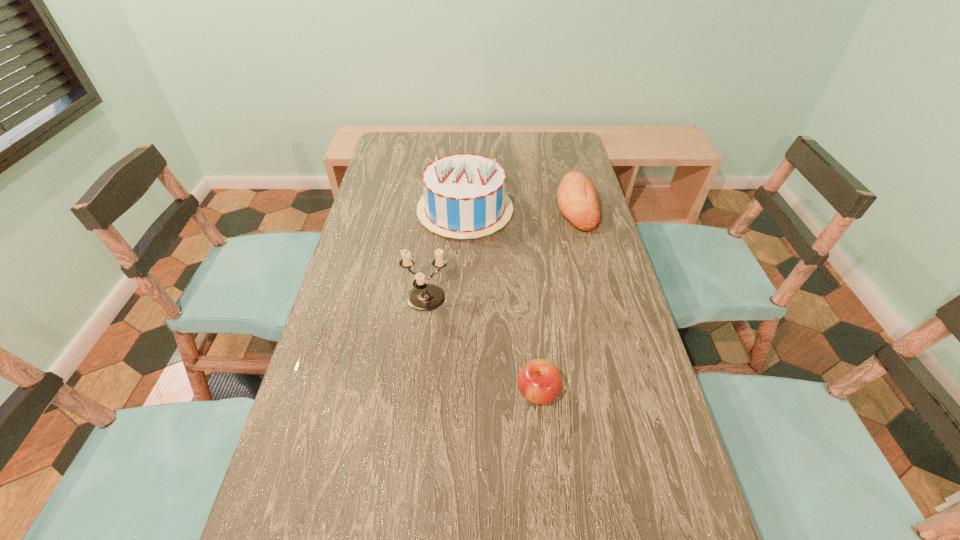
Find the location of a particular element. The width and height of the screenshot is (960, 540). vacant space that satisfies the following two spatial constraints: 1. on the back side of the rightmost object; 2. on the left side of the second nearest object is located at coordinates (437, 206).